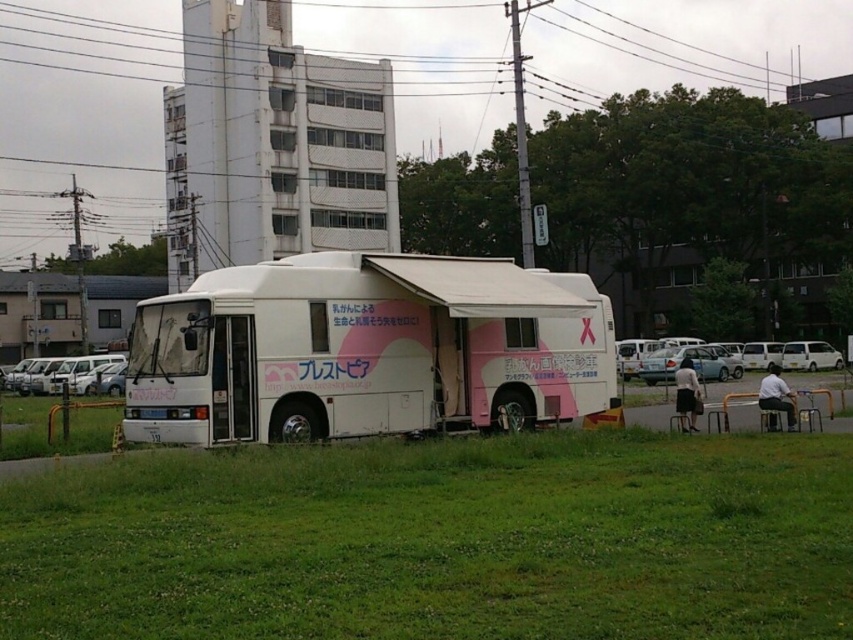
You are a delivery person who needs to park your car near the green grass at lower center and the white matte van at center. Which area has more space to park your car?

The white matte van at center has more space to park because the green grass at lower center is thinner than the white matte van at center.